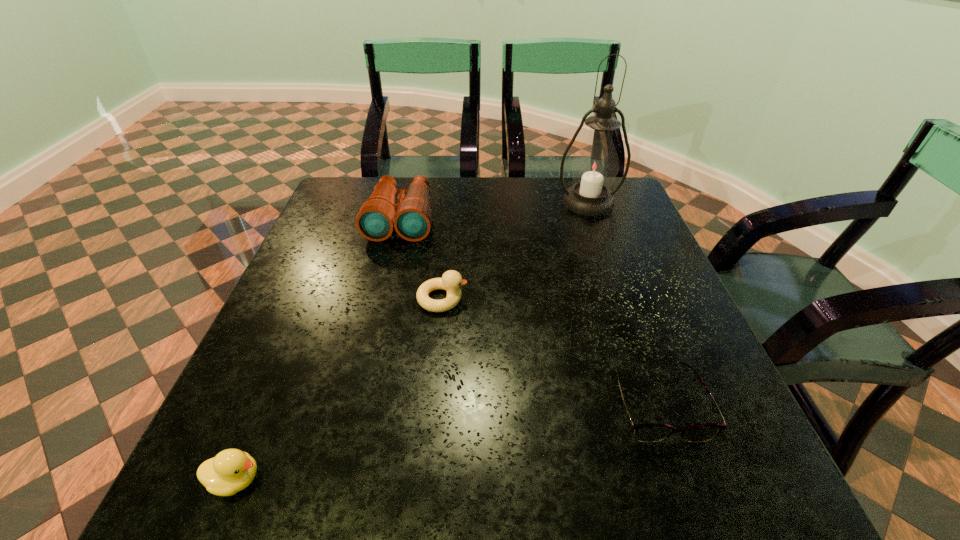
Image resolution: width=960 pixels, height=540 pixels. Find the location of `the tallest object`. the tallest object is located at coordinates (595, 165).

Identify the location of the second tallest object. The image size is (960, 540). (411, 217).

This screenshot has height=540, width=960. I want to click on the right duckling, so click(451, 280).

Locate an element on the screen. the third nearest object is located at coordinates 451,280.

Identify the location of the left duckling. Image resolution: width=960 pixels, height=540 pixels. (232, 470).

Find the location of `the nearest object`. the nearest object is located at coordinates (232, 470).

You are a GUI agent. You are given a task and a screenshot of the screen. Output one action in this format:
    pyautogui.click(x=<x>, y=<y>)
    Task: Click on the fourth farthest object
    This screenshot has height=540, width=960.
    Given the screenshot: What is the action you would take?
    pyautogui.click(x=648, y=432)

Image resolution: width=960 pixels, height=540 pixels. What are the coordinates of `spectacles` in the screenshot? It's located at (648, 432).

Where is `vacant point located 0.340m on the front of the oil lamp`? The height and width of the screenshot is (540, 960). vacant point located 0.340m on the front of the oil lamp is located at coordinates (623, 301).

Find the location of a particular element. The width and height of the screenshot is (960, 540). free space located through the lenses of the binoculars is located at coordinates (377, 318).